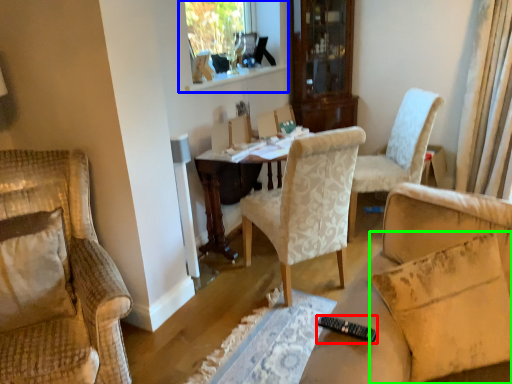
Question: Based on their relative distances, which object is farther from remote control (highlighted by a red box)? Choose from window frame (highlighted by a blue box) and pillow (highlighted by a green box).

Choices:
 (A) window frame
 (B) pillow

Answer: (A)